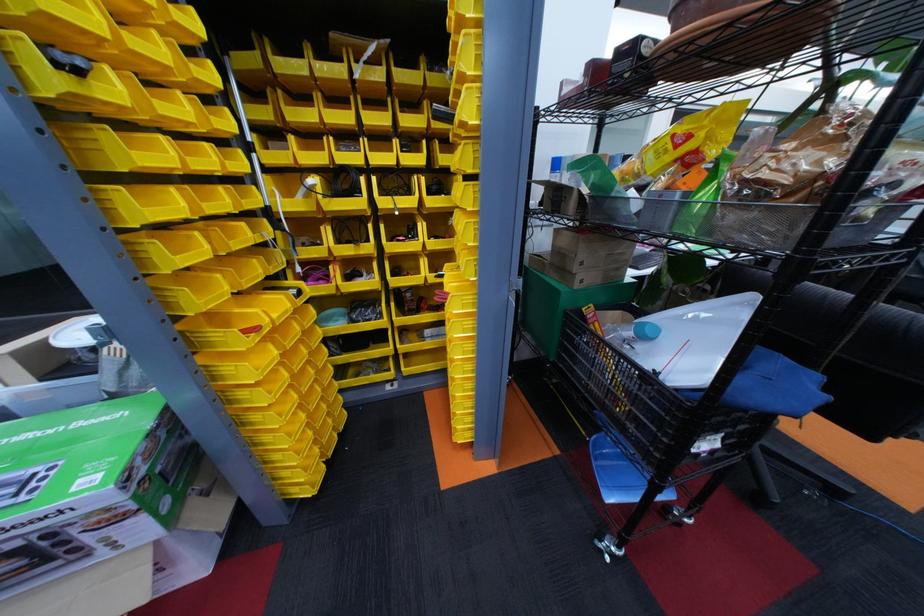
The width and height of the screenshot is (924, 616). I want to click on brown clay pot, so click(740, 39).